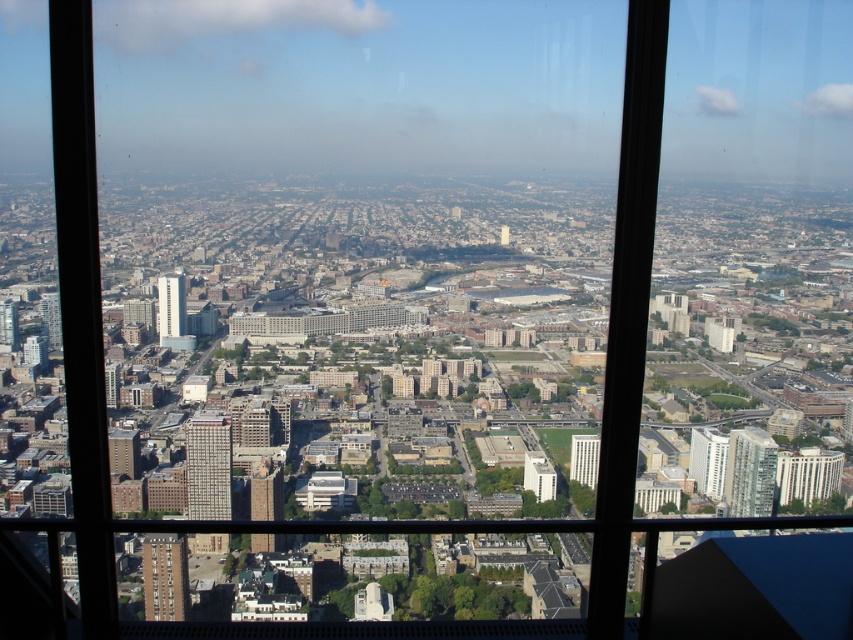
You are an urban planner reviewing this city layout. You need to determine the spatial relationship between the glassy reflective building at center right and the white concrete building at center. Based on the scene, which building is positioned lower in the vertical structure of the city?

The glassy reflective building at center right is located below the white concrete building at center, meaning it is positioned lower in the vertical structure of the city.

You are an architect evaluating the city skyline. You need to determine which building is taller between the glassy reflective building at center right and the white concrete building at center. Based on the provided information, which one is taller?

The glassy reflective building at center right is taller than the white concrete building at center.